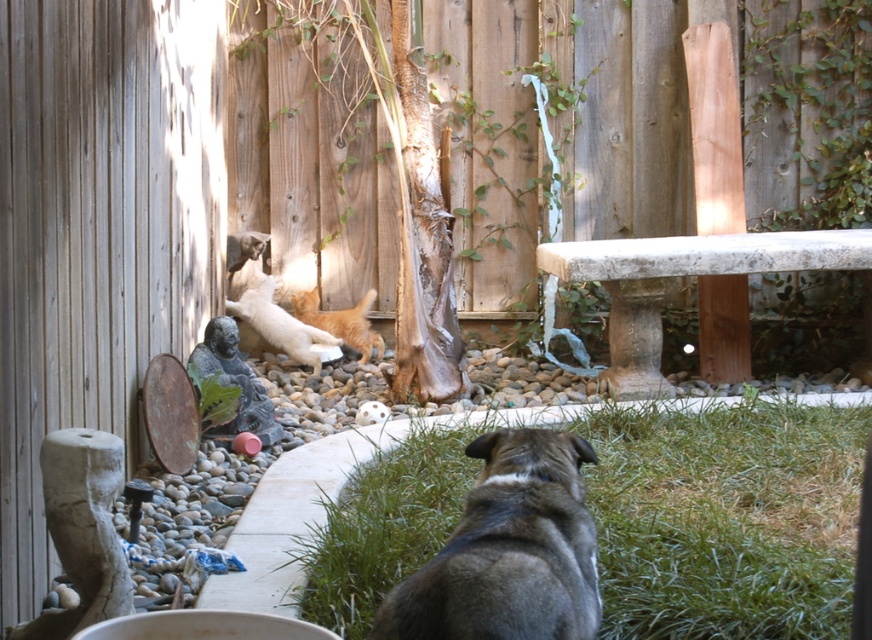
Is point (530, 554) in front of point (378, 353)?

Yes.

Locate an element on the screen. brown fur dog at lower center is located at coordinates (508, 550).

Which is behind, point (277, 333) or point (360, 355)?

The point (360, 355) is behind.

This screenshot has width=872, height=640. What do you see at coordinates (278, 323) in the screenshot? I see `fluffy white cat at center` at bounding box center [278, 323].

The width and height of the screenshot is (872, 640). What are the coordinates of `fluffy white cat at center` in the screenshot? It's located at click(278, 323).

Is point (370, 497) positioned before point (321, 336)?

Yes, point (370, 497) is in front of point (321, 336).

Does green grass at lower center have a larger size compared to fluffy white cat at center?

Indeed, green grass at lower center has a larger size compared to fluffy white cat at center.

The width and height of the screenshot is (872, 640). What do you see at coordinates (726, 518) in the screenshot?
I see `green grass at lower center` at bounding box center [726, 518].

Where is `green grass at lower center`? green grass at lower center is located at coordinates (726, 518).